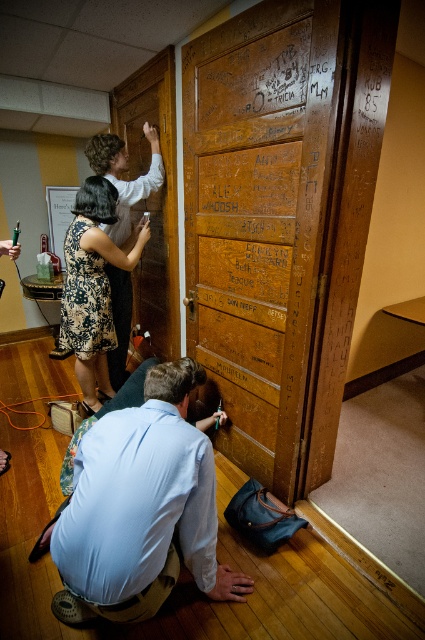
What do you see at coordinates (257, 218) in the screenshot? I see `wooden door at center` at bounding box center [257, 218].

Does point (263, 109) come closer to viewer compared to point (138, 422)?

No, (263, 109) is behind (138, 422).

This screenshot has height=640, width=425. In order to click on wooden door at center in this screenshot , I will do `click(257, 218)`.

What do you see at coordinates (257, 218) in the screenshot? I see `wooden door at center` at bounding box center [257, 218].

Locate an element on the screen. wooden door at center is located at coordinates (257, 218).

This screenshot has height=640, width=425. Identify the location of wooden door at center. (257, 218).

Does light blue shirt at lower center have a smaller size compared to floral dress at center?

Yes.

You are a GUI agent. You are given a task and a screenshot of the screen. Output one action in this format:
    pyautogui.click(x=<x>, y=<y>)
    Task: Click on the light blue shirt at lower center
    The width and height of the screenshot is (425, 640).
    Given the screenshot: What is the action you would take?
    pyautogui.click(x=141, y=509)

Locate an element on the screen. This screenshot has width=425, height=640. light blue shirt at lower center is located at coordinates (141, 509).